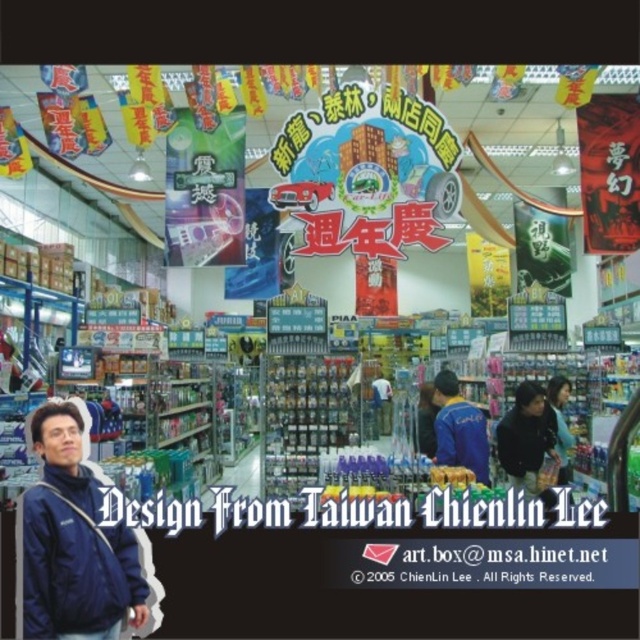
Which of these two, dark blue jacket at center or blue fabric jacket at center, stands taller?

With more height is dark blue jacket at center.

Where is `dark blue jacket at center`? dark blue jacket at center is located at coordinates (525, 436).

I want to click on dark blue jacket at center, so click(525, 436).

Is the position of blue fabric jacket at lower left more distant than that of dark blue jacket at lower right?

That is False.

Which is below, blue fabric jacket at lower left or dark blue jacket at lower right?

dark blue jacket at lower right

Is point (81, 596) positioned in front of point (552, 413)?

Yes, it is.

At what (x,y) coordinates should I click in order to perform the action: click on blue fabric jacket at lower left. Please return your answer as a coordinate pair (x, y). Looking at the image, I should click on (74, 541).

Is dark blue jacket at center behind dark blue jacket at lower right?

Yes, dark blue jacket at center is further from the viewer.

Between point (518, 394) and point (557, 445), which one is positioned behind?

Positioned behind is point (518, 394).

Which is behind, point (518, 384) or point (563, 401)?

The point (563, 401) is more distant.

Where is `dark blue jacket at center`? The height and width of the screenshot is (640, 640). dark blue jacket at center is located at coordinates (525, 436).